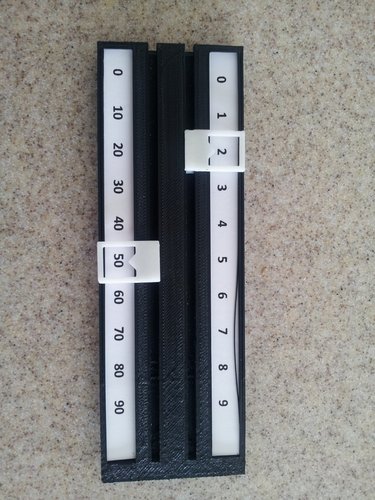
In order to click on black frame in this screenshot , I will do `click(176, 400)`.